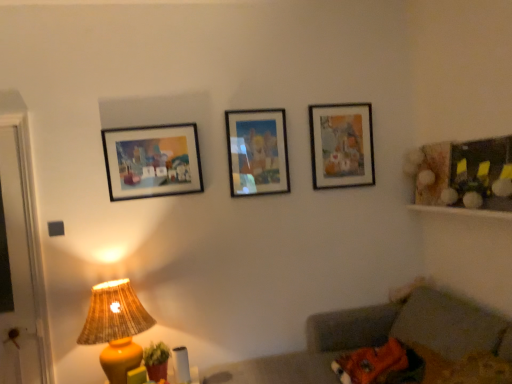
Question: Is the depth of matte wooden picture frame at upper right, the 3th picture frame when ordered from left to right, greater than that of matte plastic picture frame at center, which is the 2th picture frame from right to left?

Choices:
 (A) yes
 (B) no

Answer: (A)

Question: From the image's perspective, is matte wooden picture frame at upper right, marked as the 1th picture frame in a right-to-left arrangement, beneath matte plastic picture frame at center, the second picture frame viewed from the left?

Choices:
 (A) yes
 (B) no

Answer: (B)

Question: Could you tell me if matte wooden picture frame at upper right, marked as the 1th picture frame in a right-to-left arrangement, is facing matte plastic picture frame at center, positioned as the 2th picture frame in front-to-back order?

Choices:
 (A) yes
 (B) no

Answer: (B)

Question: Are matte wooden picture frame at upper right, the 3th picture frame when ordered from left to right, and matte plastic picture frame at center, which is the 2th picture frame from right to left, located far from each other?

Choices:
 (A) yes
 (B) no

Answer: (B)

Question: Is matte plastic picture frame at center, the second picture frame viewed from the left, surrounded by matte wooden picture frame at upper right, marked as the 1th picture frame in a right-to-left arrangement?

Choices:
 (A) no
 (B) yes

Answer: (A)

Question: Is point (118, 327) closer or farther from the camera than point (367, 173)?

Choices:
 (A) closer
 (B) farther

Answer: (A)

Question: Is yellow matte lampshade at lower left wider or thinner than matte wooden picture frame at upper right, which ranks as the first picture frame in back-to-front order?

Choices:
 (A) thin
 (B) wide

Answer: (B)

Question: From a real-world perspective, relative to matte wooden picture frame at upper right, acting as the third picture frame starting from the front, is yellow matte lampshade at lower left vertically above or below?

Choices:
 (A) above
 (B) below

Answer: (B)

Question: Considering the positions of yellow matte lampshade at lower left and matte wooden picture frame at upper right, which ranks as the first picture frame in back-to-front order, in the image, is yellow matte lampshade at lower left bigger or smaller than matte wooden picture frame at upper right, which ranks as the first picture frame in back-to-front order,?

Choices:
 (A) small
 (B) big

Answer: (B)

Question: From the image's perspective, is yellow matte lampshade at lower left above or below wooden frame at right?

Choices:
 (A) above
 (B) below

Answer: (B)

Question: Considering the positions of point (132, 301) and point (455, 152), is point (132, 301) closer or farther from the camera than point (455, 152)?

Choices:
 (A) farther
 (B) closer

Answer: (B)

Question: Looking at the image, does yellow matte lampshade at lower left seem bigger or smaller compared to wooden frame at right?

Choices:
 (A) small
 (B) big

Answer: (B)

Question: Based on their positions, is yellow matte lampshade at lower left located to the left or right of wooden frame at right?

Choices:
 (A) left
 (B) right

Answer: (A)

Question: Is matte wooden picture frame at upper right, acting as the third picture frame starting from the front, wider or thinner than matte plastic picture frame at center, positioned as the 2th picture frame in front-to-back order?

Choices:
 (A) thin
 (B) wide

Answer: (B)

Question: Is point (312, 148) positioned closer to the camera than point (232, 122)?

Choices:
 (A) farther
 (B) closer

Answer: (A)